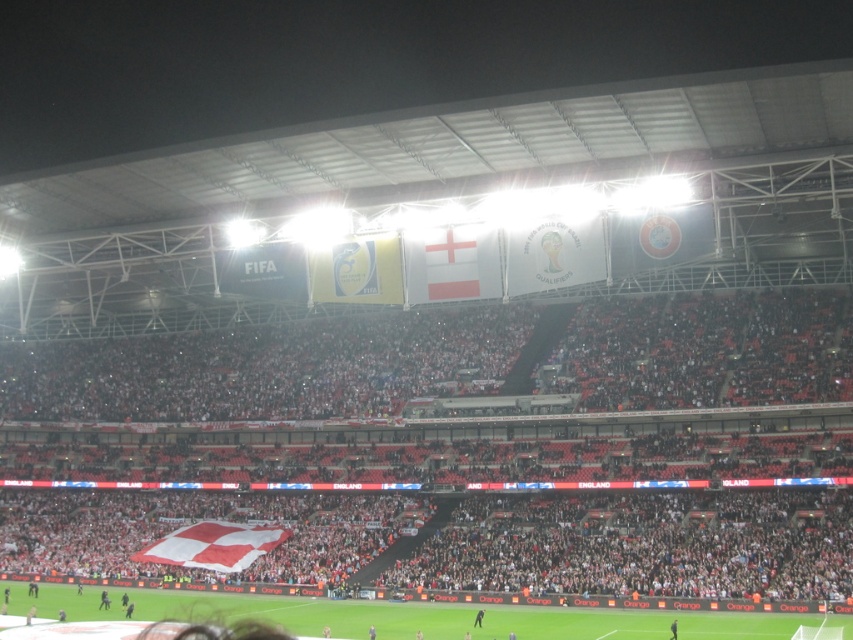
Question: Is white fabric crowd at center thinner than smooth black suit at center?

Choices:
 (A) yes
 (B) no

Answer: (B)

Question: Can you confirm if white fabric crowd at center is positioned below smooth black suit at center?

Choices:
 (A) no
 (B) yes

Answer: (A)

Question: Which of the following is the closest to the observer?

Choices:
 (A) white fabric crowd at center
 (B) smooth black suit at center

Answer: (B)

Question: Which point appears farthest from the camera in this image?

Choices:
 (A) (363, 385)
 (B) (473, 621)

Answer: (A)

Question: Does white fabric crowd at center lie behind smooth black suit at center?

Choices:
 (A) yes
 (B) no

Answer: (A)